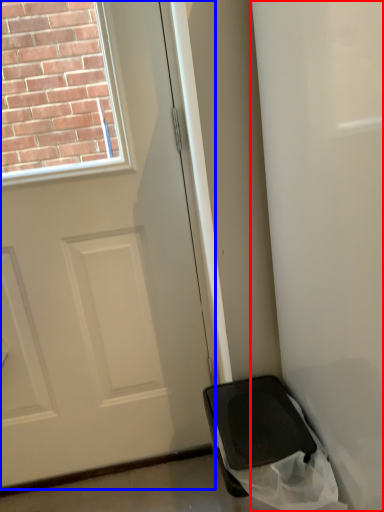
Question: Among these objects, which one is nearest to the camera, screen door (highlighted by a red box) or door (highlighted by a blue box)?

Choices:
 (A) screen door
 (B) door

Answer: (A)